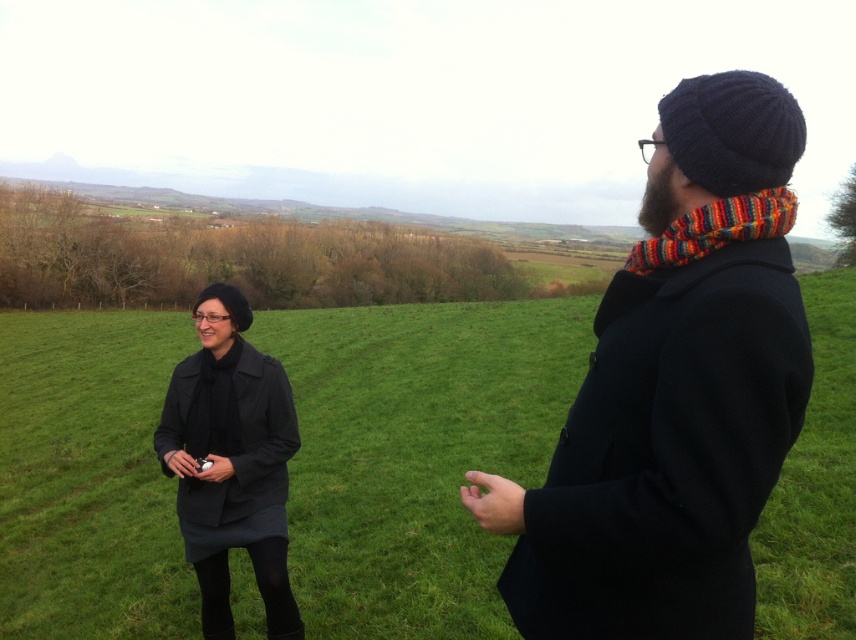
Image resolution: width=856 pixels, height=640 pixels. What do you see at coordinates (415, 452) in the screenshot?
I see `green grassy field at center` at bounding box center [415, 452].

Who is positioned more to the left, green grassy field at center or matte black coat at left?

matte black coat at left

This screenshot has width=856, height=640. What do you see at coordinates (415, 452) in the screenshot?
I see `green grassy field at center` at bounding box center [415, 452].

You are a GUI agent. You are given a task and a screenshot of the screen. Output one action in this format:
    pyautogui.click(x=<x>, y=<y>)
    Task: Click on the green grassy field at center
    
    Given the screenshot: What is the action you would take?
    pyautogui.click(x=415, y=452)

In order to click on matte black coat at left in this screenshot , I will do `click(230, 461)`.

Based on the photo, does matte black coat at left appear over knitted multicolored scarf at right?

Incorrect, matte black coat at left is not positioned above knitted multicolored scarf at right.

Between point (241, 397) and point (694, 227), which one is positioned behind?

The point (241, 397) is behind.

This screenshot has height=640, width=856. I want to click on matte black coat at left, so click(x=230, y=461).

Does point (806, 348) come behind point (730, 221)?

No, (806, 348) is closer to viewer.

Can you confirm if knitted woolen hat at upper right is positioned above knitted multicolored scarf at right?

Incorrect, knitted woolen hat at upper right is not positioned above knitted multicolored scarf at right.

Is point (492, 513) more distant than point (666, 237)?

Yes.

The width and height of the screenshot is (856, 640). In order to click on knitted woolen hat at upper right in this screenshot , I will do `click(675, 392)`.